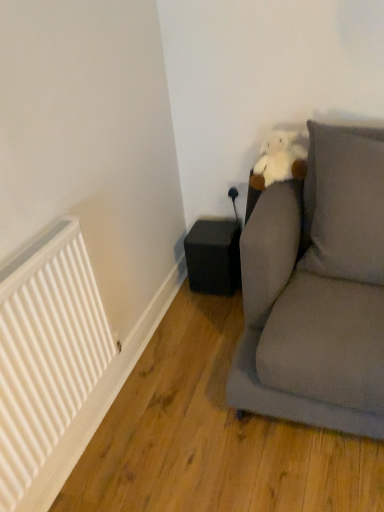
Image resolution: width=384 pixels, height=512 pixels. Describe the element at coordinates (46, 351) in the screenshot. I see `white matte radiator at left` at that location.

The height and width of the screenshot is (512, 384). I want to click on black matte speaker at lower center, so click(213, 256).

From the image's perspective, who appears lower, gray fabric pillow at upper right or black matte speaker at lower center?

black matte speaker at lower center is shown below in the image.

You are a GUI agent. You are given a task and a screenshot of the screen. Output one action in this format:
    pyautogui.click(x=<x>, y=<y>)
    Task: Click on the speaker below the gray fabric pillow at upper right (from a real-world perspective)
    This screenshot has width=384, height=512.
    Given the screenshot: What is the action you would take?
    pyautogui.click(x=213, y=256)

How far apart are gray fabric pillow at upper right and black matte speaker at lower center?

gray fabric pillow at upper right is 61.99 centimeters from black matte speaker at lower center.

Could you tell me if gray fabric pillow at upper right is turned towards black matte speaker at lower center?

No.

Are black matte speaker at lower center and gray fabric pillow at upper right making contact?

No, black matte speaker at lower center is not touching gray fabric pillow at upper right.

Which of these two, black matte speaker at lower center or gray fabric pillow at upper right, is wider?

black matte speaker at lower center.

Is black matte speaker at lower center completely or partially outside of gray fabric pillow at upper right?

Absolutely, black matte speaker at lower center is external to gray fabric pillow at upper right.

From a real-world perspective, who is located lower, black matte speaker at lower center or gray fabric pillow at upper right?

From a 3D spatial view, black matte speaker at lower center is below.

Which of these two, white matte radiator at left or gray fabric pillow at upper right, is bigger?

gray fabric pillow at upper right.

Is white matte radiator at left to the right of gray fabric pillow at upper right from the viewer's perspective?

In fact, white matte radiator at left is to the left of gray fabric pillow at upper right.

From the image's perspective, is white matte radiator at left located above gray fabric pillow at upper right?

No, from the image's perspective, white matte radiator at left is not above gray fabric pillow at upper right.

Which of these two, white matte radiator at left or gray fabric pillow at upper right, is thinner?

white matte radiator at left.

Considering their positions, is white matte radiator at left located in front of or behind black matte speaker at lower center?

white matte radiator at left is positioned closer to the viewer than black matte speaker at lower center.

From a real-world perspective, which object rests below the other?

In real-world perspective, black matte speaker at lower center is lower.

Is white matte radiator at left placed right next to black matte speaker at lower center?

There is a gap between white matte radiator at left and black matte speaker at lower center.

Looking at this image, considering the sizes of objects white matte radiator at left and black matte speaker at lower center in the image provided, who is smaller, white matte radiator at left or black matte speaker at lower center?

black matte speaker at lower center is smaller.

This screenshot has height=512, width=384. I want to click on radiator on the left of gray fabric pillow at upper right, so click(x=46, y=351).

Which of these two, gray fabric pillow at upper right or white matte radiator at left, is bigger?

With larger size is gray fabric pillow at upper right.

Is the depth of gray fabric pillow at upper right greater than that of white matte radiator at left?

That is True.

Does gray fabric pillow at upper right have a greater width compared to white matte radiator at left?

Yes, gray fabric pillow at upper right is wider than white matte radiator at left.

Does black matte speaker at lower center have a lesser height compared to white matte radiator at left?

Yes, black matte speaker at lower center is shorter than white matte radiator at left.

Between point (216, 266) and point (67, 361), which one is positioned in front?

The point (67, 361) is in front.

From a real-world perspective, between black matte speaker at lower center and white matte radiator at left, who is vertically higher?

From a 3D spatial view, white matte radiator at left is above.

Is black matte speaker at lower center facing towards white matte radiator at left?

Yes, black matte speaker at lower center is oriented towards white matte radiator at left.

Where is `pillow above the black matte speaker at lower center (from the image's perspective)`? The height and width of the screenshot is (512, 384). pillow above the black matte speaker at lower center (from the image's perspective) is located at coordinates (345, 203).

At what (x,y) coordinates should I click in order to perform the action: click on speaker behind the gray fabric pillow at upper right. Please return your answer as a coordinate pair (x, y). Looking at the image, I should click on (213, 256).

In the scene shown: Based on their spatial positions, is white matte radiator at left or black matte speaker at lower center closer to gray fabric pillow at upper right?

black matte speaker at lower center is closer to gray fabric pillow at upper right.

From the image, which object appears to be nearer to white matte radiator at left, black matte speaker at lower center or gray fabric pillow at upper right?

The object closer to white matte radiator at left is gray fabric pillow at upper right.

When comparing their distances from black matte speaker at lower center, does white matte radiator at left or gray fabric pillow at upper right seem closer?

Among the two, gray fabric pillow at upper right is located nearer to black matte speaker at lower center.

When comparing their distances from gray fabric pillow at upper right, does black matte speaker at lower center or white matte radiator at left seem further?

Among the two, white matte radiator at left is located further to gray fabric pillow at upper right.

Based on their spatial positions, is gray fabric pillow at upper right or black matte speaker at lower center further from white matte radiator at left?

black matte speaker at lower center is further to white matte radiator at left.

Considering their positions, is gray fabric pillow at upper right positioned further to black matte speaker at lower center than white matte radiator at left?

white matte radiator at left.

Locate an element on the screen. pillow between white matte radiator at left and black matte speaker at lower center along the z-axis is located at coordinates (345, 203).